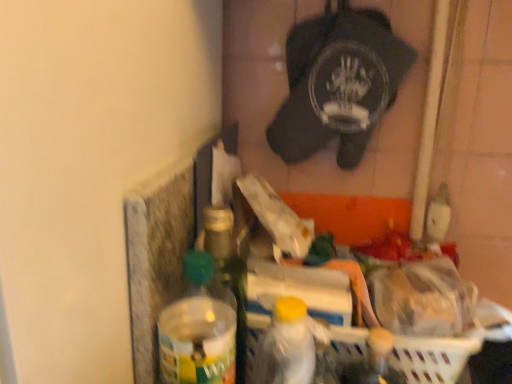
Question: Is there a large distance between translucent plastic bottle at center, which is the second bottle in left-to-right order, and white plastic bottle at center, the first bottle positioned from the right?

Choices:
 (A) no
 (B) yes

Answer: (A)

Question: Would you say translucent plastic bottle at center, the 2th bottle viewed from the right, contains white plastic bottle at center, the 3th bottle positioned from the left?

Choices:
 (A) yes
 (B) no

Answer: (B)

Question: Is translucent plastic bottle at center, which is the second bottle in left-to-right order, bigger than white plastic bottle at center, the 3th bottle positioned from the left?

Choices:
 (A) no
 (B) yes

Answer: (B)

Question: From a real-world perspective, is translucent plastic bottle at center, which is the second bottle in left-to-right order, positioned under white plastic bottle at center, the 3th bottle positioned from the left, based on gravity?

Choices:
 (A) yes
 (B) no

Answer: (B)

Question: Considering the relative positions of translucent plastic bottle at center, the 2th bottle viewed from the right, and white plastic bottle at center, the first bottle positioned from the right, in the image provided, is translucent plastic bottle at center, the 2th bottle viewed from the right, in front of white plastic bottle at center, the first bottle positioned from the right,?

Choices:
 (A) no
 (B) yes

Answer: (A)

Question: Is white plastic basket at lower right inside or outside of translucent plastic bottle at center, positioned as the 1th bottle in left-to-right order?

Choices:
 (A) outside
 (B) inside

Answer: (A)

Question: From a real-world perspective, relative to translucent plastic bottle at center, positioned as the 1th bottle in left-to-right order, is white plastic basket at lower right vertically above or below?

Choices:
 (A) below
 (B) above

Answer: (A)

Question: In terms of height, does white plastic basket at lower right look taller or shorter compared to translucent plastic bottle at center, which is the third bottle in right-to-left order?

Choices:
 (A) tall
 (B) short

Answer: (B)

Question: Based on their sizes in the image, would you say white plastic basket at lower right is bigger or smaller than translucent plastic bottle at center, positioned as the 1th bottle in left-to-right order?

Choices:
 (A) small
 (B) big

Answer: (A)

Question: Is point coord(215,215) closer or farther from the camera than point coord(344,339)?

Choices:
 (A) farther
 (B) closer

Answer: (B)

Question: From the image's perspective, relative to white plastic basket at lower right, is translucent plastic bottle at center, which is the second bottle in left-to-right order, above or below?

Choices:
 (A) above
 (B) below

Answer: (A)

Question: In terms of size, does translucent plastic bottle at center, which is the second bottle in left-to-right order, appear bigger or smaller than white plastic basket at lower right?

Choices:
 (A) big
 (B) small

Answer: (A)

Question: In the image, is translucent plastic bottle at center, the 2th bottle viewed from the right, positioned in front of or behind white plastic basket at lower right?

Choices:
 (A) front
 (B) behind

Answer: (B)

Question: From the image's perspective, is translucent plastic bottle at center, positioned as the 1th bottle in left-to-right order, positioned above or below white plastic basket at lower right?

Choices:
 (A) below
 (B) above

Answer: (B)

Question: In terms of width, does translucent plastic bottle at center, positioned as the 1th bottle in left-to-right order, look wider or thinner when compared to white plastic basket at lower right?

Choices:
 (A) wide
 (B) thin

Answer: (A)